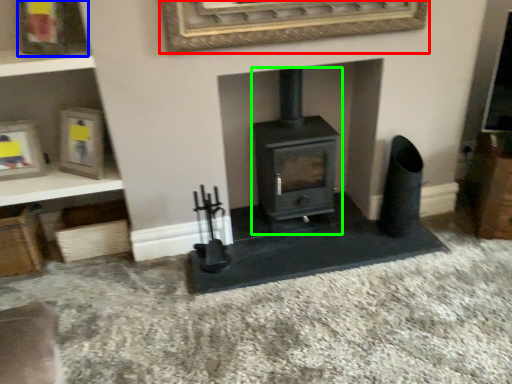
Question: Based on their relative distances, which object is farther from picture frame (highlighted by a red box)? Choose from picture frame (highlighted by a blue box) and wood burning stove (highlighted by a green box).

Choices:
 (A) picture frame
 (B) wood burning stove

Answer: (A)